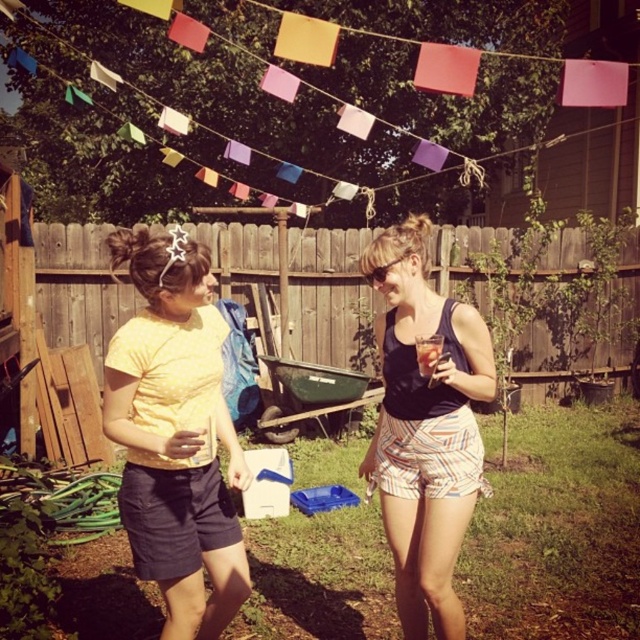
Does yellow dotted shirt at center have a greater width compared to matte black tank top at center?

Yes, yellow dotted shirt at center is wider than matte black tank top at center.

Which is behind, point (193, 372) or point (394, 305)?

The point (394, 305) is behind.

Does point (182, 394) come in front of point (464, 365)?

Yes, point (182, 394) is in front of point (464, 365).

Image resolution: width=640 pixels, height=640 pixels. What are the coordinates of `yellow dotted shirt at center` in the screenshot? It's located at (176, 435).

Is colorful paper flags at upper center below yellow dotted shirt at center?

Incorrect, colorful paper flags at upper center is not positioned below yellow dotted shirt at center.

Does colorful paper flags at upper center have a lesser width compared to yellow dotted shirt at center?

In fact, colorful paper flags at upper center might be wider than yellow dotted shirt at center.

Identify the location of colorful paper flags at upper center. (317, 104).

Where is `colorful paper flags at upper center`? This screenshot has height=640, width=640. colorful paper flags at upper center is located at coordinates (317, 104).

Describe the element at coordinates (317, 104) in the screenshot. I see `colorful paper flags at upper center` at that location.

Between point (500, 81) and point (426, 557), which one is positioned behind?

The point (500, 81) is more distant.

Where is `colorful paper flags at upper center`? This screenshot has width=640, height=640. colorful paper flags at upper center is located at coordinates (317, 104).

This screenshot has width=640, height=640. I want to click on colorful paper flags at upper center, so click(x=317, y=104).